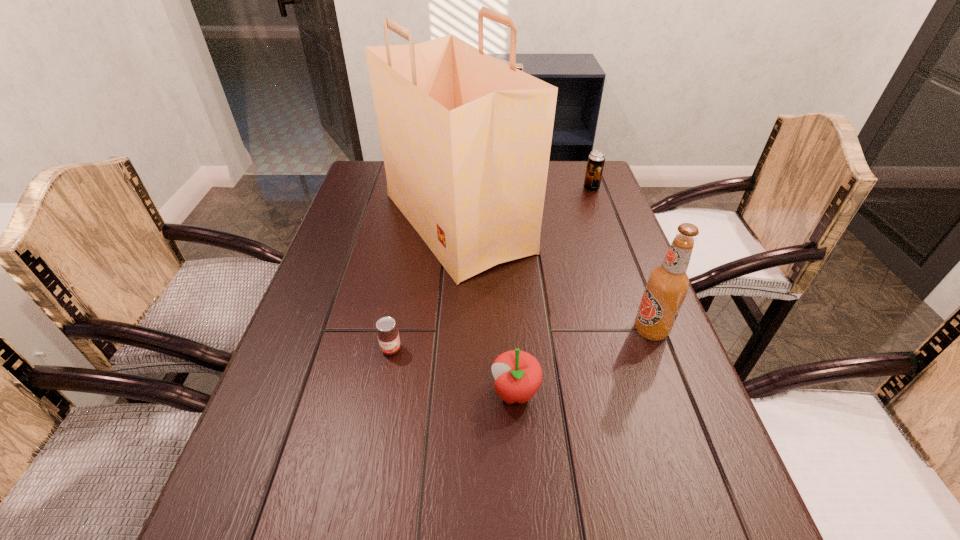
The height and width of the screenshot is (540, 960). In order to click on the tallest object in this screenshot , I will do `click(466, 139)`.

The image size is (960, 540). Find the location of `beer bottle`. beer bottle is located at coordinates (668, 284).

Where is `beer can`? The width and height of the screenshot is (960, 540). beer can is located at coordinates (596, 160).

Identify the location of apple. (518, 375).

I want to click on jam, so click(388, 337).

Image resolution: width=960 pixels, height=540 pixels. What are the coordinates of `blank space located on the side of the grocery bag with the superhero design` in the screenshot? It's located at (562, 222).

Find the location of `free space located 0.050m on the front label of the second tallest object`. free space located 0.050m on the front label of the second tallest object is located at coordinates (610, 330).

Identify the location of vacant space located 0.200m on the front label of the second tallest object. (542, 330).

Where is `vacant region located on the front label of the second tallest object`? vacant region located on the front label of the second tallest object is located at coordinates (485, 330).

You are a GUI agent. You are given a task and a screenshot of the screen. Output one action in this format:
    pyautogui.click(x=<x>, y=<y>)
    Task: Click on the vacant space situated on the front of the beer can
    The height and width of the screenshot is (540, 960).
    Given the screenshot: What is the action you would take?
    pyautogui.click(x=605, y=227)